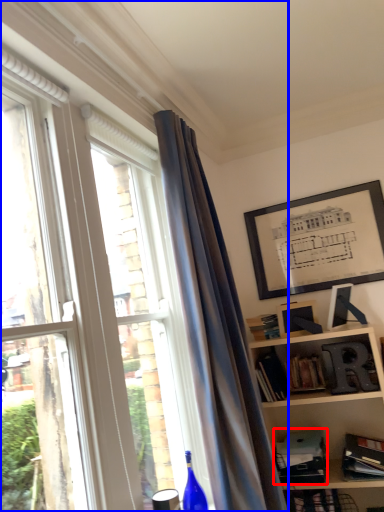
Question: Which object appears closest to the camera in this image, paperback book (highlighted by a red box) or window (highlighted by a blue box)?

Choices:
 (A) paperback book
 (B) window

Answer: (B)